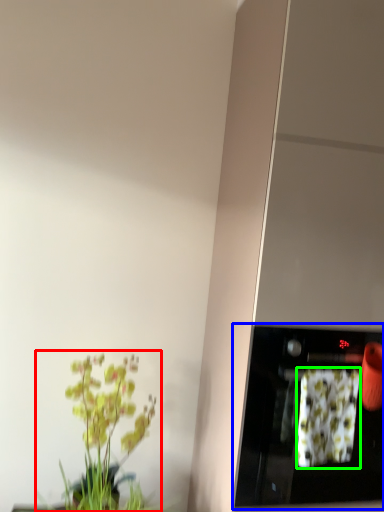
Question: Estimate the real-world distances between objects in this image. Which object is farther from houseplant (highlighted by a red box), appliance (highlighted by a blue box) or flower (highlighted by a green box)?

Choices:
 (A) appliance
 (B) flower

Answer: (B)